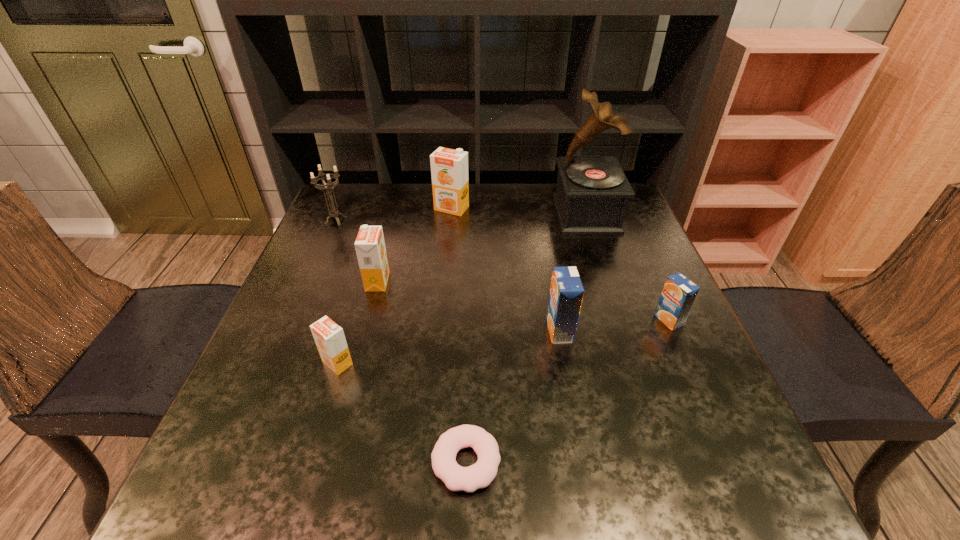
The image size is (960, 540). In order to click on vacant area that lies between the fourth orange juice from left to right and the shortest object in this screenshot , I will do `click(513, 396)`.

The width and height of the screenshot is (960, 540). In order to click on vacant space that is in between the sixth object from left to right and the farthest orange juice in this screenshot , I will do `click(506, 269)`.

Locate an element on the screen. This screenshot has height=540, width=960. free space between the phonograph_record and the candle holder is located at coordinates (461, 217).

Locate an element on the screen. The width and height of the screenshot is (960, 540). free space between the fourth orange juice from left to right and the shortest object is located at coordinates (513, 396).

In order to click on free space that is in between the shortest object and the second farthest orange juice in this screenshot , I will do `click(421, 372)`.

Find the location of `free space between the second smallest orange orange juice and the tallest object`. free space between the second smallest orange orange juice and the tallest object is located at coordinates (482, 248).

You are a GUI agent. You are given a task and a screenshot of the screen. Output one action in this format:
    pyautogui.click(x=<x>, y=<y>)
    Task: Click on the free space that is in between the candle holder and the doughnut
    
    Given the screenshot: What is the action you would take?
    pyautogui.click(x=401, y=341)

Locate an element on the screen. The height and width of the screenshot is (540, 960). vacant space that is in between the nearest orange juice and the left blue orange_juice is located at coordinates point(448,347).

Where is `object identified as the sixth closest to the second nearest object`? Image resolution: width=960 pixels, height=540 pixels. object identified as the sixth closest to the second nearest object is located at coordinates (592, 192).

The height and width of the screenshot is (540, 960). I want to click on object that is the second closest to the second biggest orange orange juice, so point(334,213).